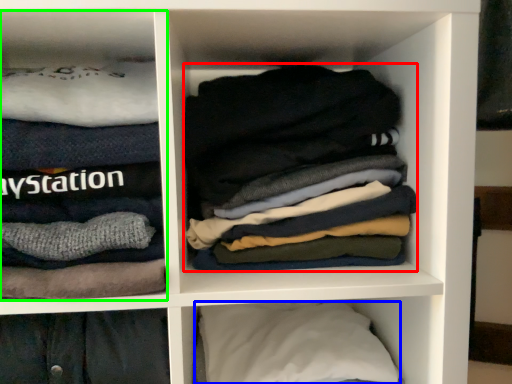
Question: Which object is positioned closest to laundry (highlighted by a red box)? Select from pillow (highlighted by a blue box) and cabinet (highlighted by a green box).

Choices:
 (A) pillow
 (B) cabinet

Answer: (B)